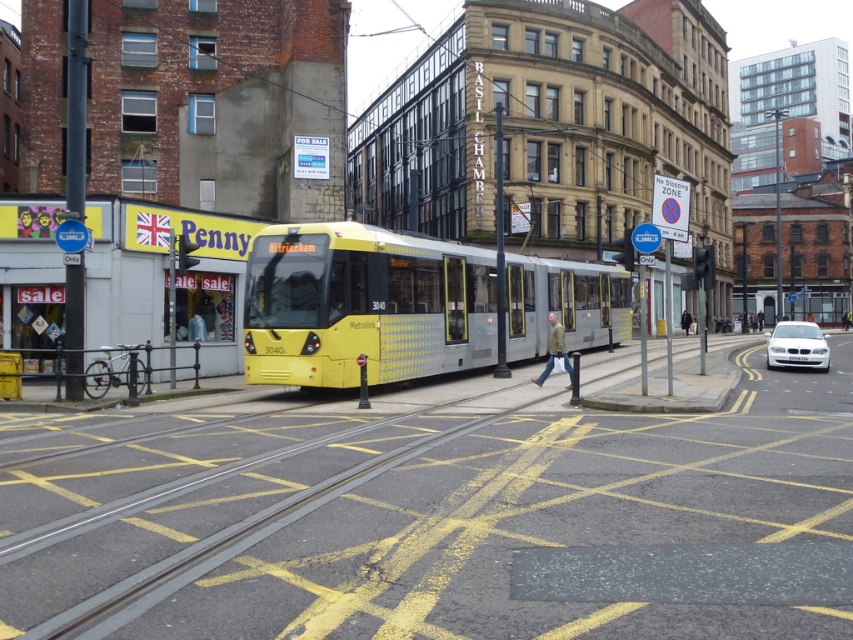
The width and height of the screenshot is (853, 640). In order to click on yellow metallic tram at center in this screenshot , I will do `click(364, 305)`.

Is yellow metallic tram at center in front of white glossy car at lower right?

Yes, yellow metallic tram at center is in front of white glossy car at lower right.

Does point (436, 292) lie in front of point (781, 362)?

Yes, it is.

Identify the location of yellow metallic tram at center. The width and height of the screenshot is (853, 640). (364, 305).